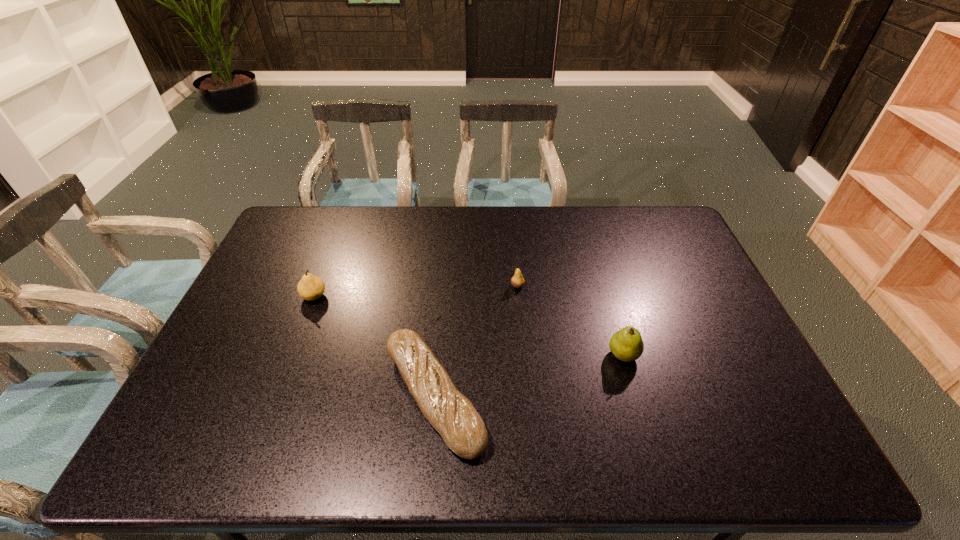
Identify the location of blank region between the shortest pear and the second object from left to right. The image size is (960, 540). (476, 341).

Identify the location of vacant space that is in between the third object from right to left and the second object from right to left. (476, 341).

Locate an element on the screen. vacant area that lies between the baguet and the second pear from right to left is located at coordinates (476, 341).

Find the location of a particular element. This screenshot has height=540, width=960. blank region between the leftmost object and the rightmost pear is located at coordinates (468, 326).

Locate an element on the screen. object identified as the third closest to the leftmost pear is located at coordinates (627, 345).

Point out which object is positioned as the second nearest to the shortest pear. Please provide its 2D coordinates. Your answer should be formatted as a tuple, i.e. [(x, y)], where the tuple contains the x and y coordinates of a point satisfying the conditions above.

[(627, 345)]

Identify the location of pear identified as the second closest to the third object from right to left. The height and width of the screenshot is (540, 960). (310, 287).

Identify which pear is the nearest to the second pear from left to right. Please provide its 2D coordinates. Your answer should be formatted as a tuple, i.e. [(x, y)], where the tuple contains the x and y coordinates of a point satisfying the conditions above.

[(627, 345)]